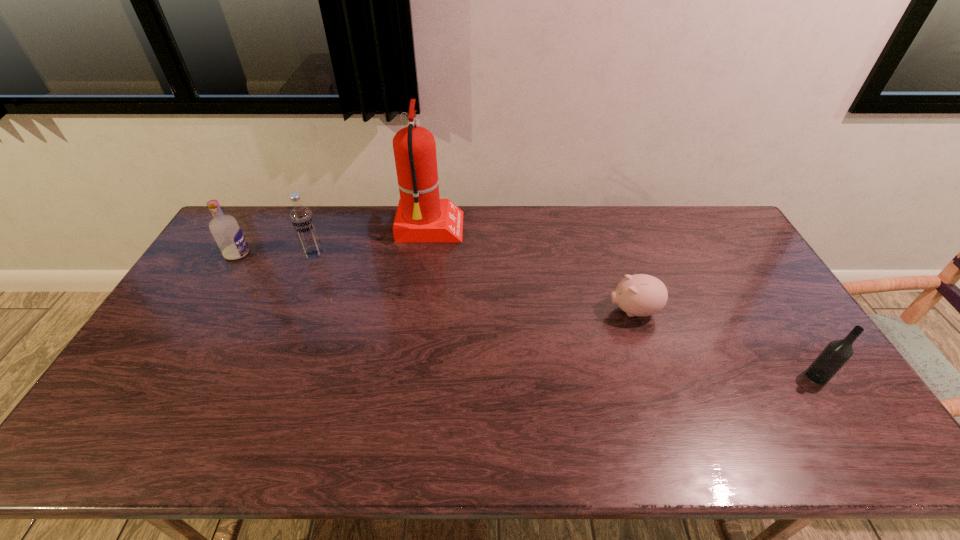
At what (x,y) coordinates should I click in order to perform the action: click on fire extinguisher. Please return your answer as a coordinate pair (x, y). Looking at the image, I should click on (421, 216).

Locate an element on the screen. This screenshot has width=960, height=540. the tallest object is located at coordinates (421, 216).

Locate an element on the screen. the second object from left to right is located at coordinates (302, 219).

I want to click on the leftmost vodka, so pyautogui.click(x=226, y=231).

Locate an element on the screen. This screenshot has width=960, height=540. the nearest object is located at coordinates (837, 353).

Identify the location of the rightmost vodka. The image size is (960, 540). click(837, 353).

Find the location of a particular element. The width and height of the screenshot is (960, 540). the fourth object from left to right is located at coordinates (638, 295).

I want to click on the second nearest object, so click(x=638, y=295).

At what (x,y) coordinates should I click in order to perform the action: click on free space located on the front-facing side of the fire extinguisher. Please return your answer as a coordinate pair (x, y). The height and width of the screenshot is (540, 960). Looking at the image, I should click on (501, 229).

In order to click on blank area located 0.360m on the front label of the second vodka from left to right in this screenshot , I will do `click(276, 345)`.